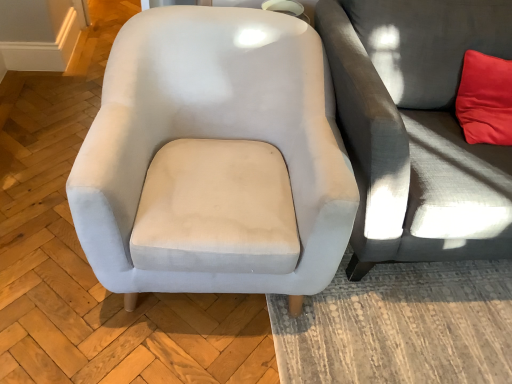
Question: From the image's perspective, would you say satin light gray armchair at center is positioned over gray fabric couch at right?

Choices:
 (A) yes
 (B) no

Answer: (B)

Question: Is satin light gray armchair at center located outside gray fabric couch at right?

Choices:
 (A) no
 (B) yes

Answer: (B)

Question: Is satin light gray armchair at center directly adjacent to gray fabric couch at right?

Choices:
 (A) no
 (B) yes

Answer: (A)

Question: Is satin light gray armchair at center shorter than gray fabric couch at right?

Choices:
 (A) no
 (B) yes

Answer: (B)

Question: Is satin light gray armchair at center smaller than gray fabric couch at right?

Choices:
 (A) no
 (B) yes

Answer: (B)

Question: Would you consider satin light gray armchair at center to be distant from gray fabric couch at right?

Choices:
 (A) yes
 (B) no

Answer: (B)

Question: From the image's perspective, is gray fabric couch at right located above satin light gray armchair at center?

Choices:
 (A) no
 (B) yes

Answer: (B)

Question: Does gray fabric couch at right have a lesser width compared to satin light gray armchair at center?

Choices:
 (A) no
 (B) yes

Answer: (A)

Question: Is gray fabric couch at right not near satin light gray armchair at center?

Choices:
 (A) yes
 (B) no

Answer: (B)

Question: Is gray fabric couch at right turned away from satin light gray armchair at center?

Choices:
 (A) no
 (B) yes

Answer: (A)

Question: Is gray fabric couch at right in front of satin light gray armchair at center?

Choices:
 (A) yes
 (B) no

Answer: (B)

Question: Can you confirm if gray fabric couch at right is positioned to the left of satin light gray armchair at center?

Choices:
 (A) yes
 (B) no

Answer: (B)

Question: Looking at their shapes, would you say satin light gray armchair at center is wider or thinner than gray fabric couch at right?

Choices:
 (A) wide
 (B) thin

Answer: (B)